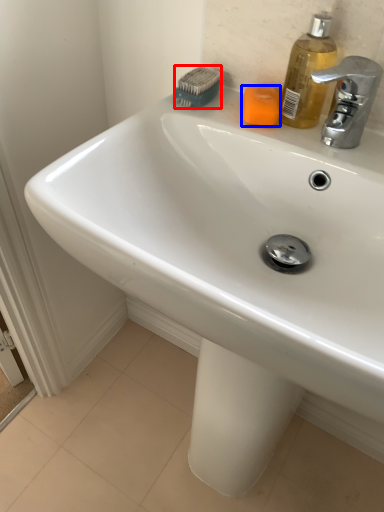
Question: Which point is closer to the camera, brush (highlighted by a red box) or soap (highlighted by a blue box)?

Choices:
 (A) brush
 (B) soap

Answer: (B)